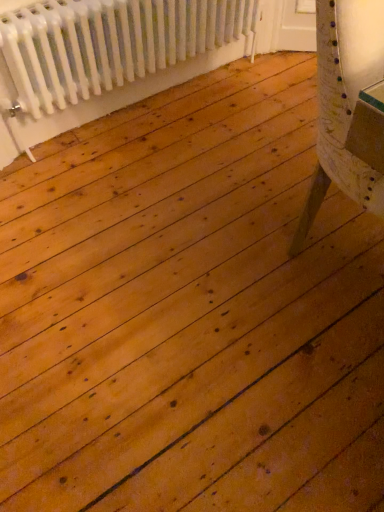
At what (x,y) coordinates should I click in order to perform the action: click on white matte radiator at upper left. Please return your answer as a coordinate pair (x, y). Looking at the image, I should click on (110, 44).

What do you see at coordinates (110, 44) in the screenshot? I see `white matte radiator at upper left` at bounding box center [110, 44].

Find the location of `white matte radiator at upper left`. white matte radiator at upper left is located at coordinates (110, 44).